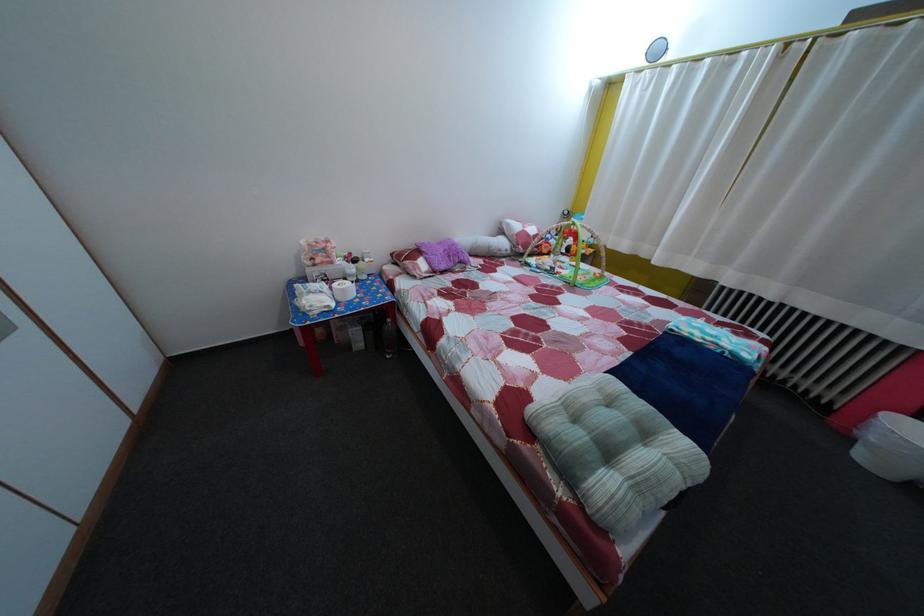
Where would you lift the white plastic bucket? Please return your answer as a coordinate pair (x, y).

(891, 446)